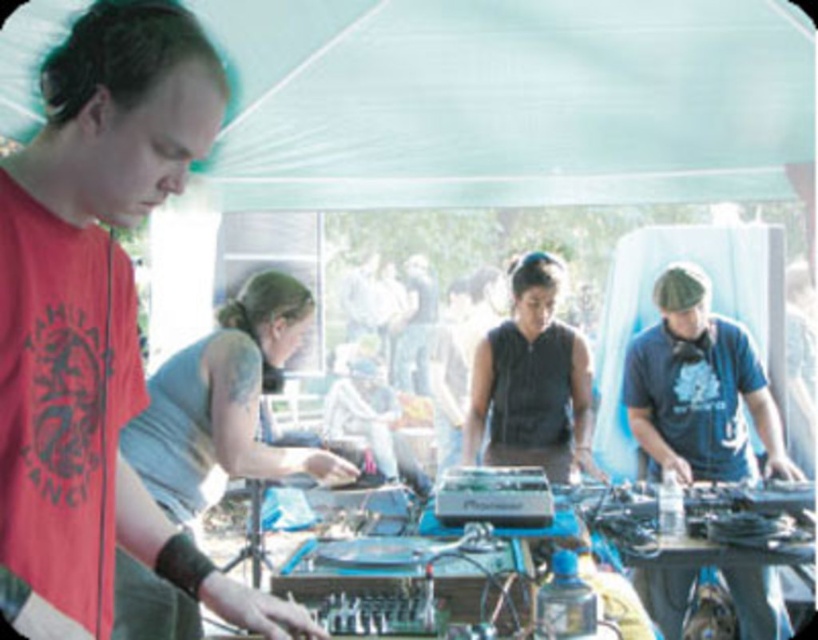
Is point (282, 108) less distant than point (571, 456)?

Yes, it is in front of point (571, 456).

Consider the image. Can you confirm if transparent nylon canopy at upper center is thinner than black matte vest at center?

No, transparent nylon canopy at upper center is not thinner than black matte vest at center.

The height and width of the screenshot is (640, 818). What do you see at coordinates (510, 100) in the screenshot?
I see `transparent nylon canopy at upper center` at bounding box center [510, 100].

Find the location of `transparent nylon canopy at upper center`. transparent nylon canopy at upper center is located at coordinates (510, 100).

Can you confirm if gray matte shirt at center is shorter than blue fabric hat at right?

In fact, gray matte shirt at center may be taller than blue fabric hat at right.

Does gray matte shirt at center have a larger size compared to blue fabric hat at right?

Yes, gray matte shirt at center is bigger than blue fabric hat at right.

Is point (155, 595) less distant than point (686, 600)?

That is True.

Identify the location of gray matte shirt at center. The width and height of the screenshot is (818, 640). (223, 404).

Is gray matte shirt at center smaller than black matte vest at center?

Incorrect, gray matte shirt at center is not smaller in size than black matte vest at center.

Is gray matte shirt at center further to the viewer compared to black matte vest at center?

No, it is not.

What do you see at coordinates (223, 404) in the screenshot?
I see `gray matte shirt at center` at bounding box center [223, 404].

At what (x,y) coordinates should I click in order to perform the action: click on gray matte shirt at center. Please return your answer as a coordinate pair (x, y). Looking at the image, I should click on (223, 404).